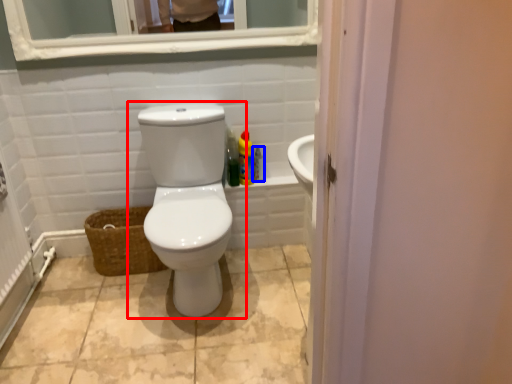
Question: Which of the following is the closest to the observer, toilet (highlighted by a red box) or cleaning product (highlighted by a blue box)?

Choices:
 (A) toilet
 (B) cleaning product

Answer: (A)